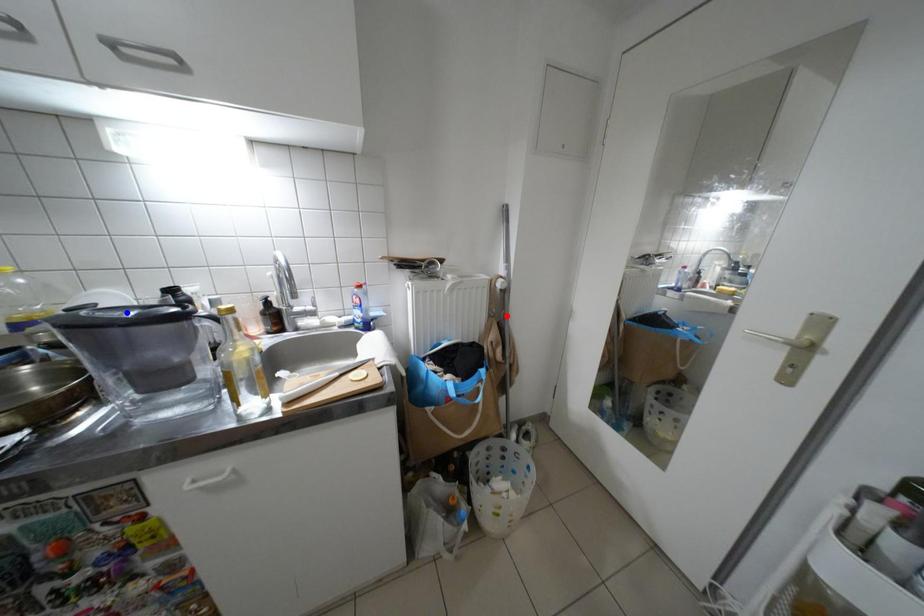
Question: In the image, two points are highlighted. Which point is nearer to the camera? Reply with the corresponding letter.

Choices:
 (A) blue point
 (B) red point

Answer: (A)